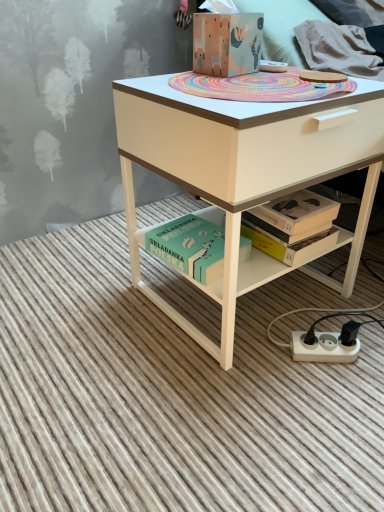
What are the coordinates of `free space in front of matte white desk at center` in the screenshot? It's located at (228, 416).